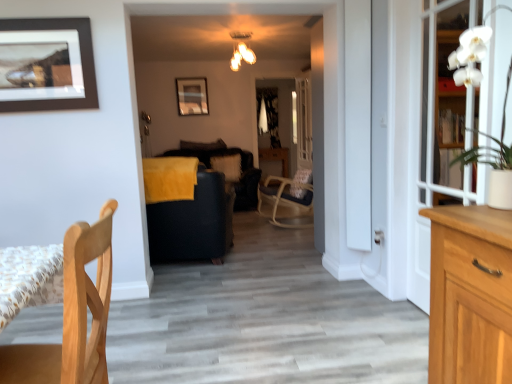
The height and width of the screenshot is (384, 512). What are the coordinates of `empty space that is ontop of brown matte picture frame at upper left, positioned as the first picture frame in front-to-back order (from a real-world perspective)` in the screenshot? It's located at (45, 14).